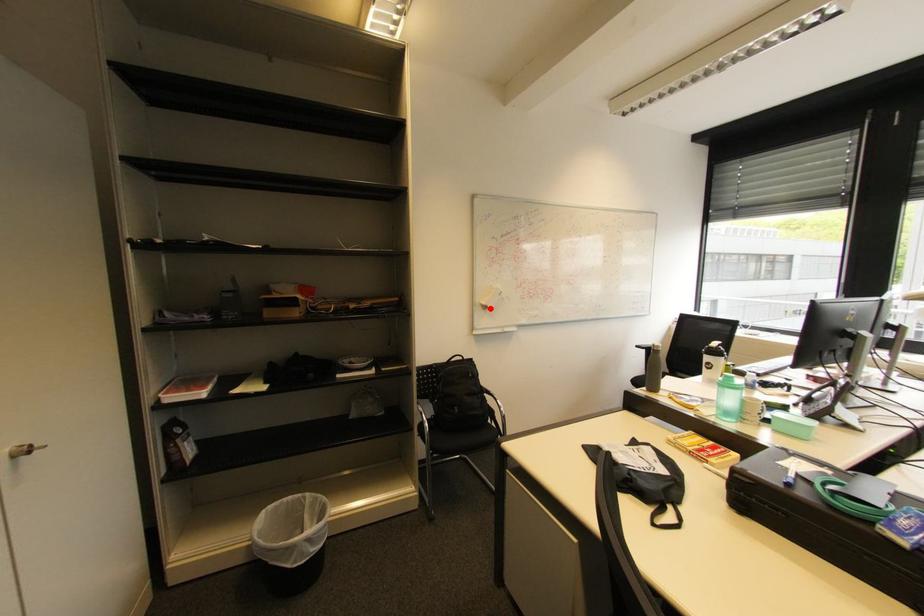
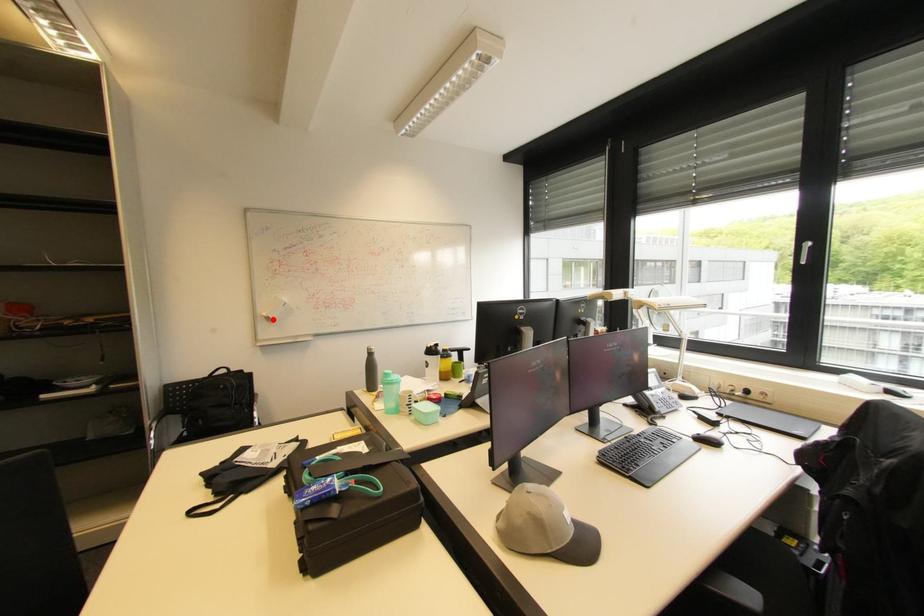
I am providing you with two images of the same scene from different viewpoints. A red point is marked on the first image and another point is marked on the second image. Do the highlighted points in image1 and image2 indicate the same real-world spot?

Yes